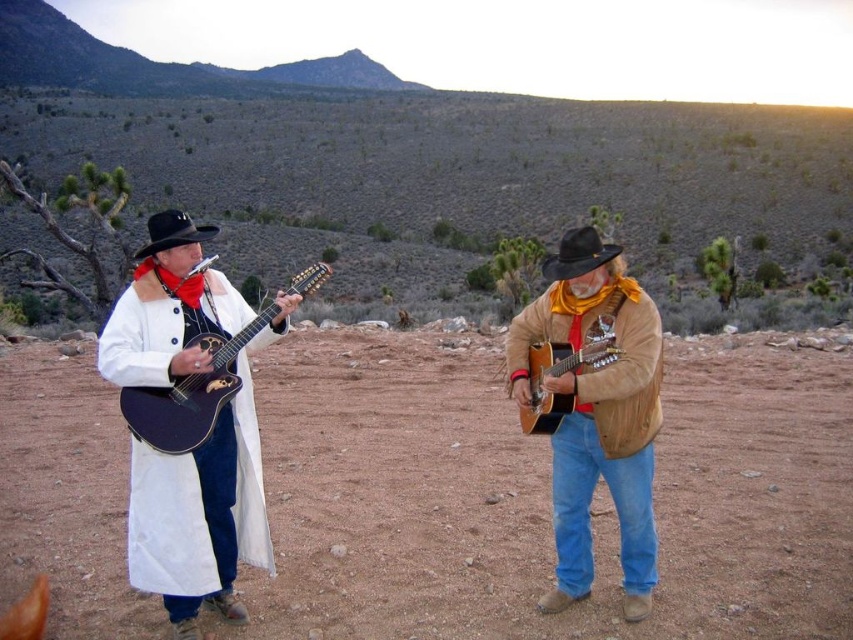
You are a photographer standing in front of the two guitarists in the desert. You want to take a photo that includes both points mentioned. Which point, point (181, 344) or point (561, 259), is closer to the camera?

Point (181, 344) is closer to the camera than point (561, 259).

You are a photographer trying to capture a clear shot of the acoustic wood guitar at center and the black felt cowboy hat at left. Based on their positions, which object should you focus on first to ensure both are in focus?

The acoustic wood guitar at center is in front of the black felt cowboy hat at left, so you should focus on the black felt cowboy hat at left first to ensure both are in focus.